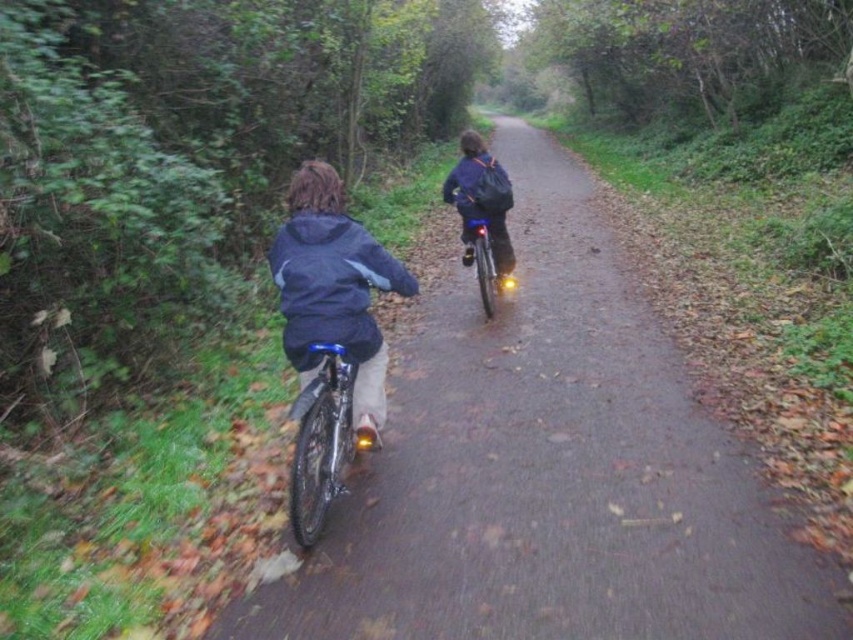
You are planning to ride a bicycle through a narrow path in a forested area. You see the matte blue bicycle at center and the dark blue jacket at center. Which object is wider?

The matte blue bicycle at center is wider than the dark blue jacket at center.

You are a pedestrian walking along the path and see the matte blue bicycle at center and the dark blue matte jacket at center. Which object is closer to the ground?

The matte blue bicycle at center is below dark blue matte jacket at center, so the matte blue bicycle at center is closer to the ground.

You are a cyclist planning to ride through the narrow path shown in the image. You have a bicycle that is 2 feet wide. There are two bicycles present in the image. Which bicycle among the shiny metallic bicycle at center and the shiny black bicycle at center would allow you to pass safely without touching the other bicycle if you ride on the same path?

The shiny metallic bicycle at center has a smaller width than the shiny black bicycle at center. Since your bicycle is 2 feet wide, you should choose to pass the shiny metallic bicycle at center as it occupies less space, allowing for a safer passage without touching.